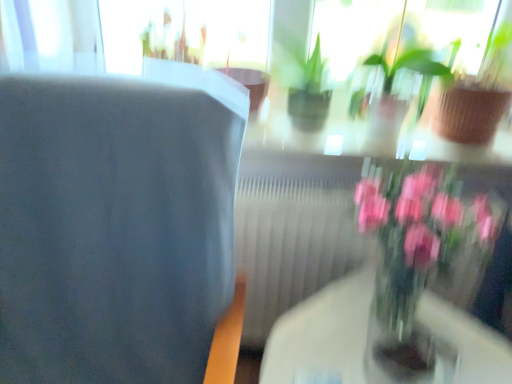
Question: Is green glossy houseplant at upper center, the 1th houseplant positioned from the left, at the back of pink glass vase at right?

Choices:
 (A) yes
 (B) no

Answer: (B)

Question: Can you confirm if pink glass vase at right is positioned to the left of green glossy houseplant at upper center, which is counted as the 2th houseplant, starting from the right?

Choices:
 (A) yes
 (B) no

Answer: (A)

Question: Is pink glass vase at right smaller than green glossy houseplant at upper center, the 1th houseplant positioned from the left?

Choices:
 (A) no
 (B) yes

Answer: (A)

Question: Can you confirm if pink glass vase at right is thinner than green glossy houseplant at upper center, the 1th houseplant positioned from the left?

Choices:
 (A) yes
 (B) no

Answer: (B)

Question: From a real-world perspective, is pink glass vase at right physically below green glossy houseplant at upper center, the 1th houseplant positioned from the left?

Choices:
 (A) no
 (B) yes

Answer: (B)

Question: Is transparent glass door at upper center inside or outside of pink glass vase at right?

Choices:
 (A) inside
 (B) outside

Answer: (B)

Question: In terms of height, does transparent glass door at upper center look taller or shorter compared to pink glass vase at right?

Choices:
 (A) tall
 (B) short

Answer: (B)

Question: Considering the positions of point [x=164, y=16] and point [x=362, y=195], is point [x=164, y=16] closer or farther from the camera than point [x=362, y=195]?

Choices:
 (A) closer
 (B) farther

Answer: (B)

Question: From the image's perspective, is transparent glass door at upper center located above or below pink glass vase at right?

Choices:
 (A) below
 (B) above

Answer: (B)

Question: From their relative heights in the image, would you say pink glass vase at right is taller or shorter than transparent glass door at upper center?

Choices:
 (A) short
 (B) tall

Answer: (B)

Question: Considering their positions, is pink glass vase at right located in front of or behind transparent glass door at upper center?

Choices:
 (A) front
 (B) behind

Answer: (A)

Question: From a real-world perspective, is pink glass vase at right positioned above or below transparent glass door at upper center?

Choices:
 (A) above
 (B) below

Answer: (B)

Question: Is pink glass vase at right bigger or smaller than transparent glass door at upper center?

Choices:
 (A) small
 (B) big

Answer: (B)

Question: Is point (499, 51) closer or farther from the camera than point (391, 69)?

Choices:
 (A) closer
 (B) farther

Answer: (B)

Question: Considering the positions of green matte plant at upper right, which is the 2th houseplant from left to right, and green glossy houseplant at upper center, which is counted as the 2th houseplant, starting from the right, in the image, is green matte plant at upper right, which is the 2th houseplant from left to right, taller or shorter than green glossy houseplant at upper center, which is counted as the 2th houseplant, starting from the right,?

Choices:
 (A) tall
 (B) short

Answer: (A)